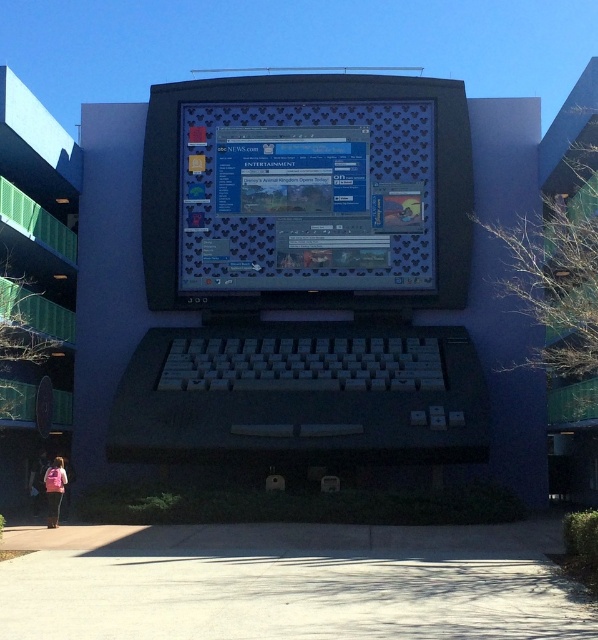
Question: Which object is farther from the camera taking this photo?

Choices:
 (A) gray concrete pavement at lower center
 (B) shiny plastic screen at center
 (C) matte black laptop at center
 (D) pink fabric at lower left

Answer: (B)

Question: Observing the image, what is the correct spatial positioning of matte black laptop at center in reference to shiny plastic screen at center?

Choices:
 (A) left
 (B) right

Answer: (A)

Question: Which of these objects is positioned closest to the matte black laptop at center?

Choices:
 (A) pink fabric at lower left
 (B) gray concrete pavement at lower center
 (C) shiny plastic screen at center

Answer: (C)

Question: Can you confirm if shiny plastic screen at center is positioned above pink fabric at lower left?

Choices:
 (A) no
 (B) yes

Answer: (B)

Question: Which is nearer to the shiny plastic screen at center?

Choices:
 (A) gray concrete pavement at lower center
 (B) matte black laptop at center

Answer: (B)

Question: Can you confirm if gray concrete pavement at lower center is positioned to the left of pink fabric at lower left?

Choices:
 (A) yes
 (B) no

Answer: (B)